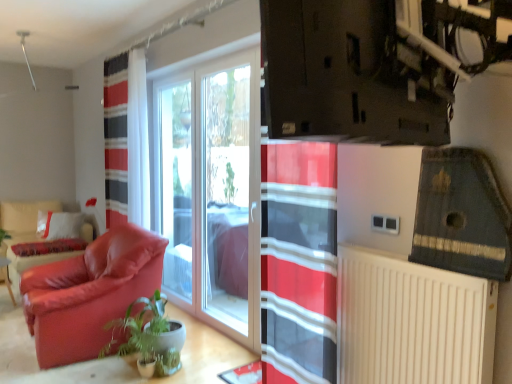
Image resolution: width=512 pixels, height=384 pixels. Identify the location of vacant area to the right of green glossy plant at lower left. (203, 367).